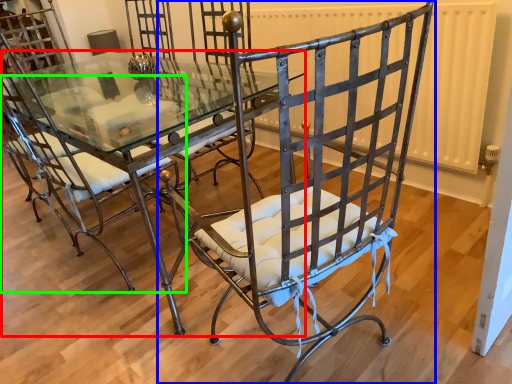
Question: Which is farther away from table (highlighted by a red box)? chair (highlighted by a blue box) or chair (highlighted by a green box)?

Choices:
 (A) chair
 (B) chair

Answer: (A)